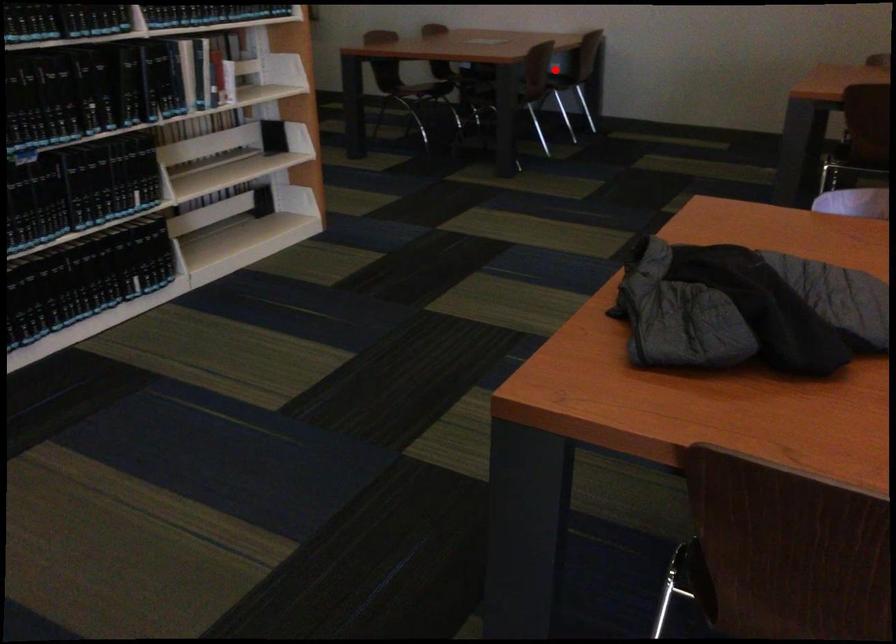
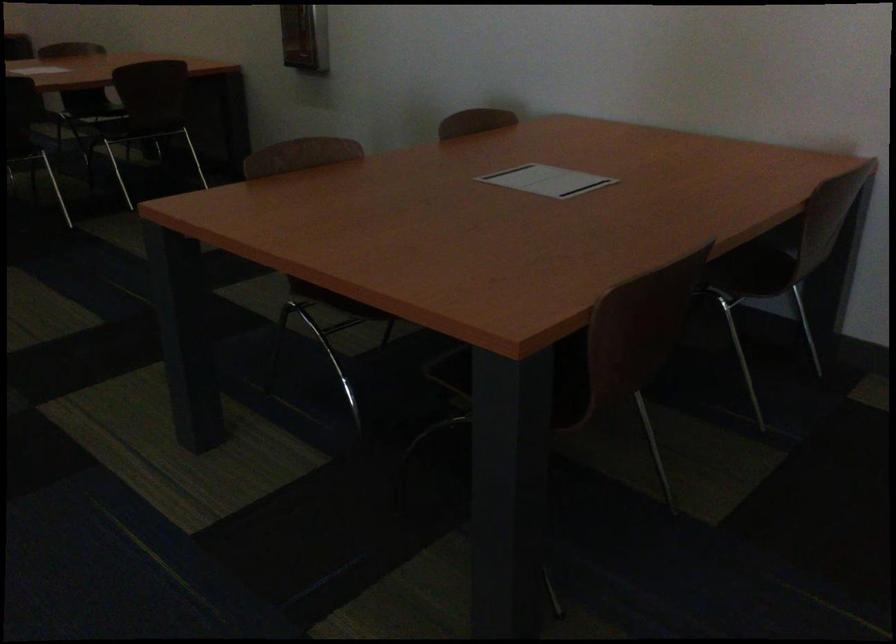
Question: I am providing you with two images of the same scene from different viewpoints. Image1 has a red point marked. In image2, the corresponding 3D location appears at what relative position? Reply with the corresponding letter.

Choices:
 (A) Closer
 (B) Farther

Answer: (A)